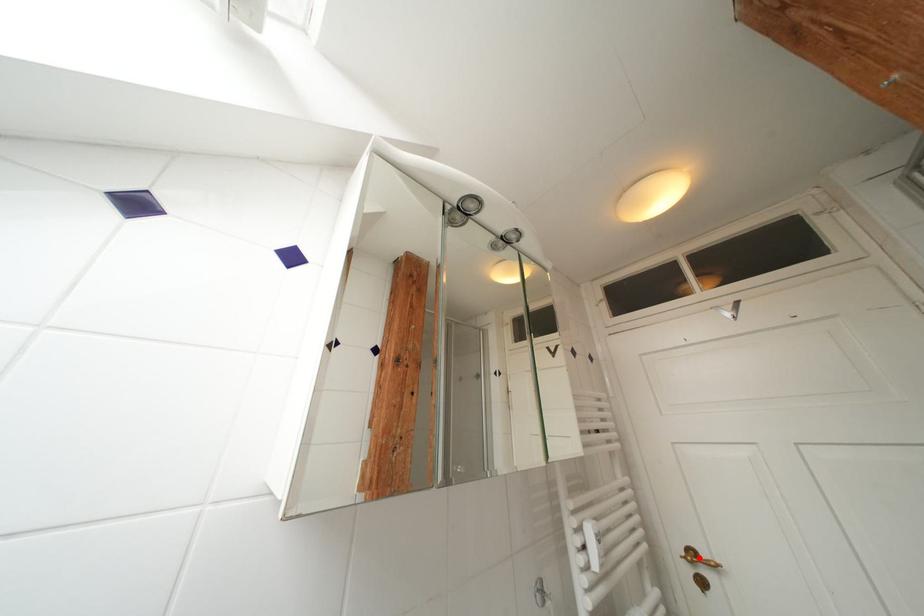
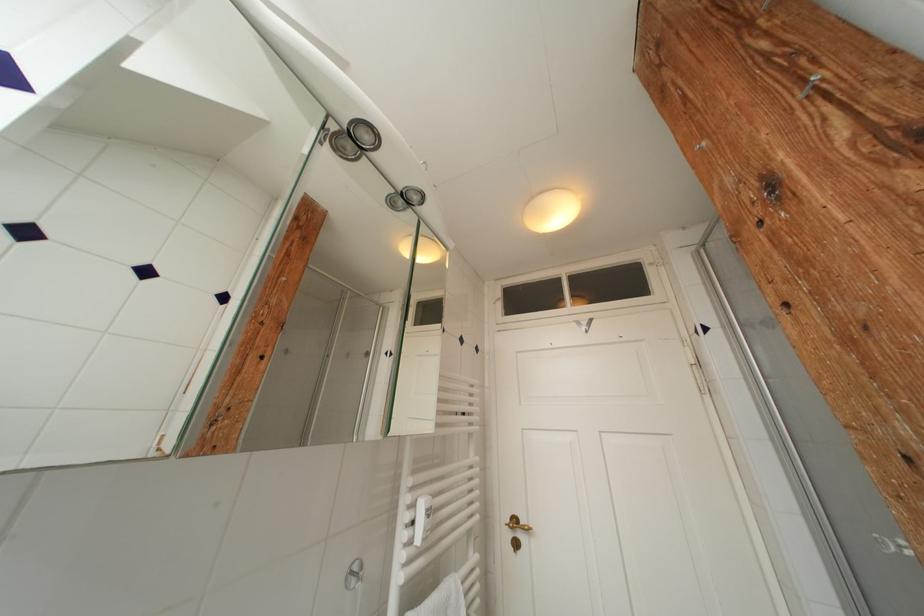
In the second image, find the point that corresponds to the highlighted location in the first image.

(521, 525)